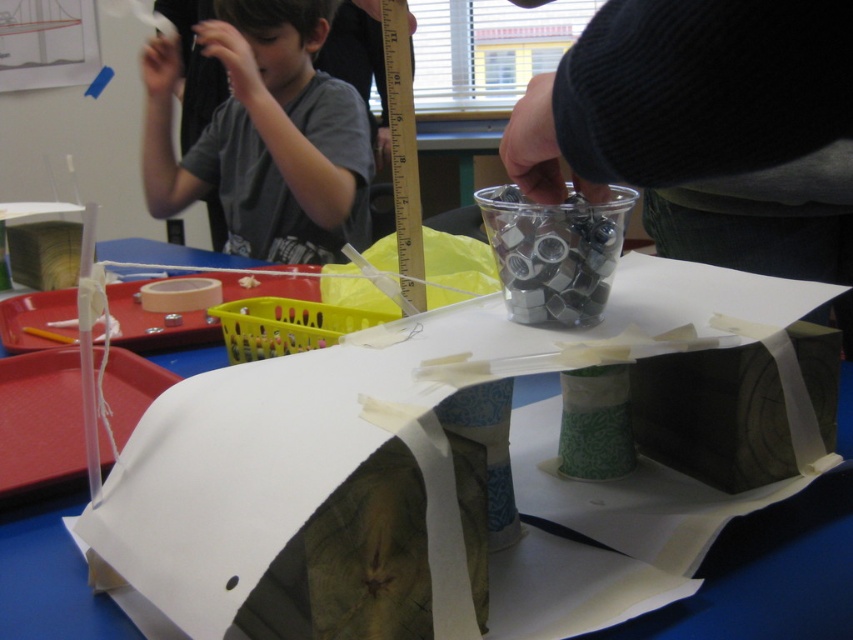
Question: Is blue paper at center smaller than matte pink tape at left?

Choices:
 (A) no
 (B) yes

Answer: (A)

Question: Which point is closer to the camera?

Choices:
 (A) gray cotton shirt at upper left
 (B) matte pink tape at left

Answer: (B)

Question: Which is nearer to the matte pink tape at left?

Choices:
 (A) gray cotton shirt at upper left
 (B) blue paper at center

Answer: (B)

Question: Is blue paper at center to the right of matte pink tape at left from the viewer's perspective?

Choices:
 (A) yes
 (B) no

Answer: (B)

Question: Which of the following is the farthest from the observer?

Choices:
 (A) (154, 113)
 (B) (838, 413)

Answer: (A)

Question: Can you confirm if gray cotton shirt at upper left is smaller than matte pink tape at left?

Choices:
 (A) yes
 (B) no

Answer: (B)